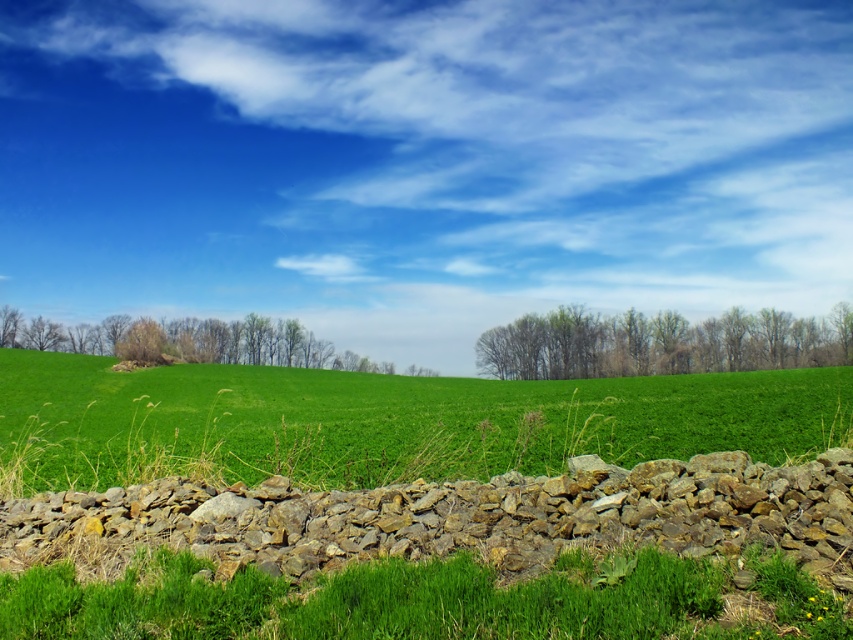
Question: Can you confirm if green grassy field at center is wider than green leafy trees at center?

Choices:
 (A) yes
 (B) no

Answer: (A)

Question: Based on their relative distances, which object is nearer to the green leafy trees at center?

Choices:
 (A) green leafy tree at left
 (B) rustic stone wall at center

Answer: (A)

Question: Can you confirm if rustic stone wall at center is positioned above green leafy tree at left?

Choices:
 (A) yes
 (B) no

Answer: (A)

Question: Which point appears closest to the camera in this image?

Choices:
 (A) (654, 340)
 (B) (120, 349)
 (C) (19, 508)
 (D) (210, 380)

Answer: (C)

Question: Which of the following is the farthest from the observer?

Choices:
 (A) green leafy tree at left
 (B) green grassy field at center
 (C) green leafy trees at center
 (D) rustic stone wall at center

Answer: (C)

Question: Does green leafy trees at center appear on the left side of green leafy tree at left?

Choices:
 (A) yes
 (B) no

Answer: (B)